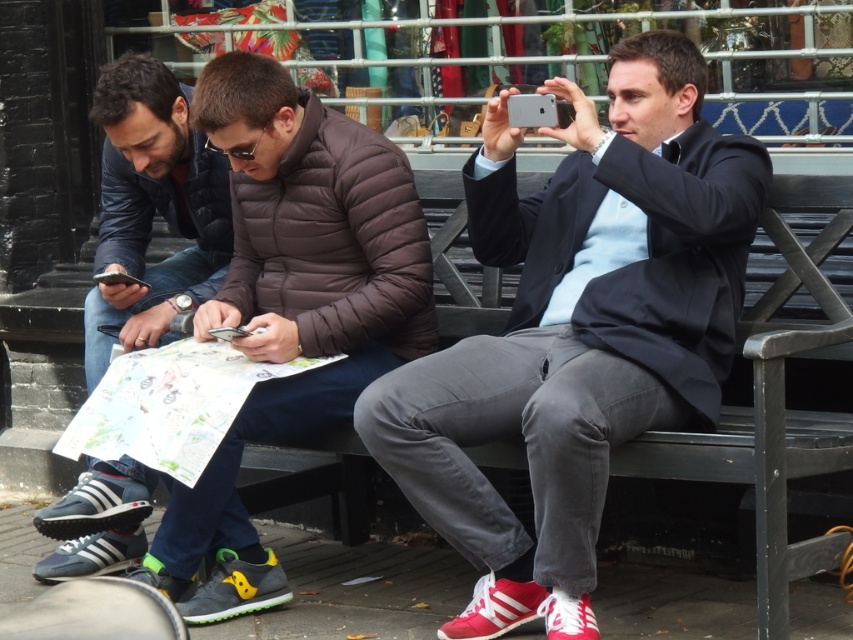
You are standing at the origin point in the image. Where is the matte brown jacket at center located in terms of coordinates?

The matte brown jacket at center is located at coordinates point (x=292, y=305).

You are a photographer trying to capture a group photo of the matte black jacket at left and the matte brown jacket at center. The camera you are using has a fixed focus that can only accommodate up to two people if they are within a certain width. Based on their positions and the description provided, do you think both individuals can fit within the camera frame without needing to move? Please explain your reasoning.

The matte brown jacket at center might be wider than the matte black jacket at left. Since the camera can only accommodate two people within a certain width, and the brown jacket is possibly wider, there might not be enough space. Therefore, it is uncertain if both can fit without adjusting their positions.